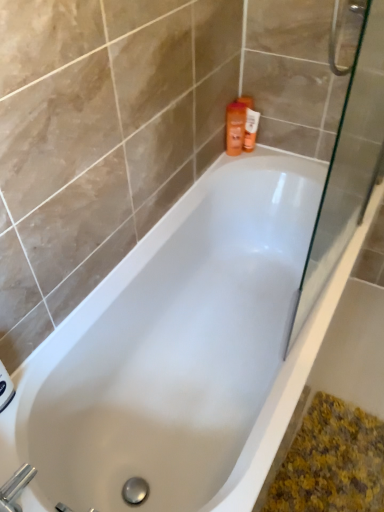
Identify the location of vacant area that lies to the right of orange matte bottle at upper right. (278, 159).